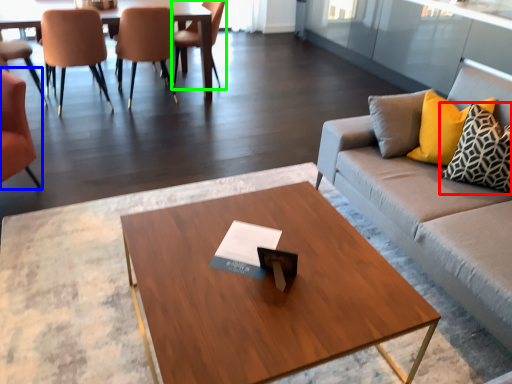
Question: Based on their relative distances, which object is nearer to pillow (highlighted by a red box)? Choose from chair (highlighted by a blue box) and chair (highlighted by a green box).

Choices:
 (A) chair
 (B) chair

Answer: (A)